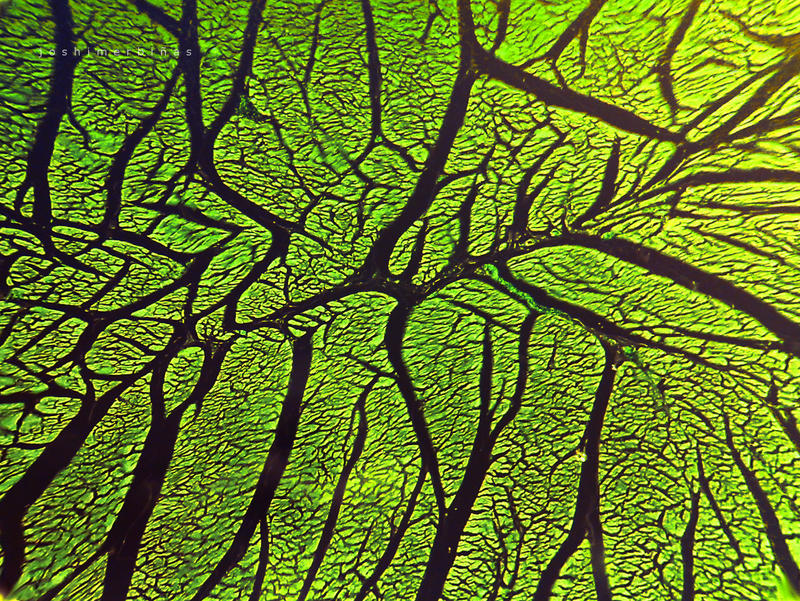
At what (x,y) coordinates should I click in order to perform the action: click on area of brighter lighting. Please return your answer as a coordinate pair (x, y). The width and height of the screenshot is (800, 601). Looking at the image, I should click on (758, 10).